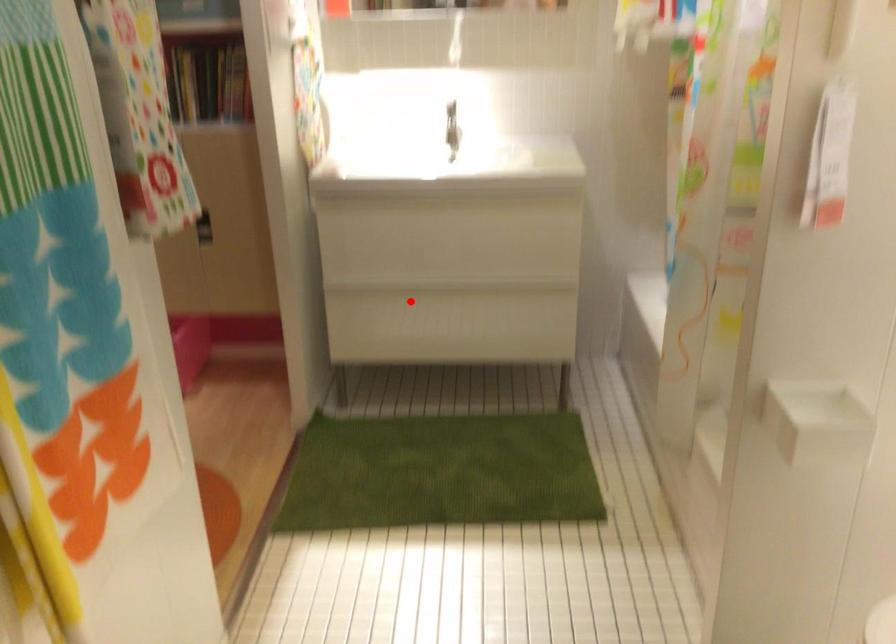
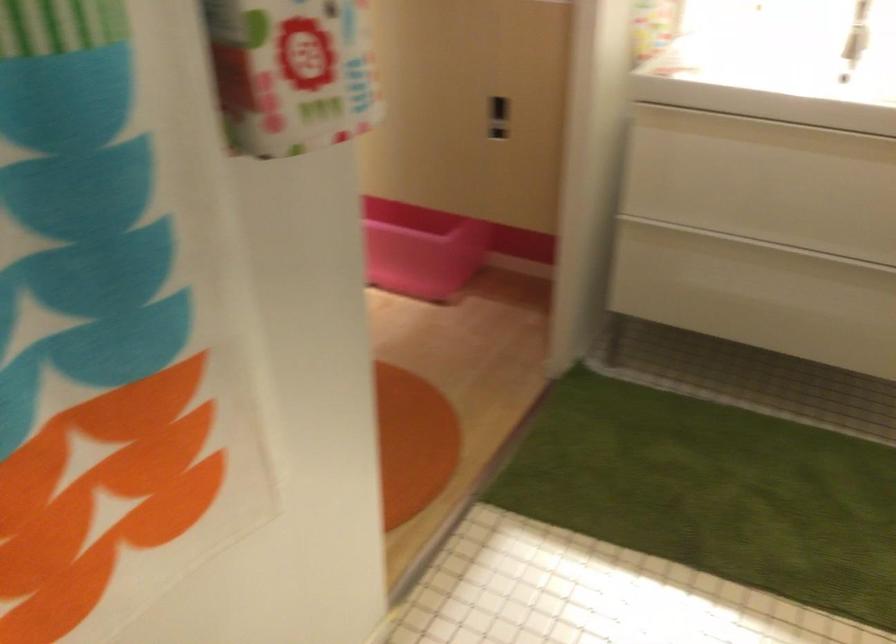
The point at the highlighted location is marked in the first image. Where is the corresponding point in the second image?

(734, 254)